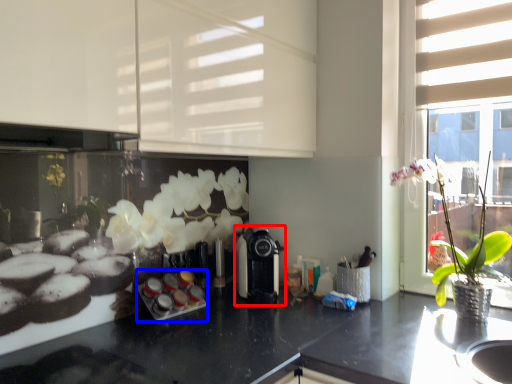
Question: Which of the following is the closest to the observer, coffee machine (highlighted by a red box) or appliance (highlighted by a blue box)?

Choices:
 (A) coffee machine
 (B) appliance

Answer: (B)